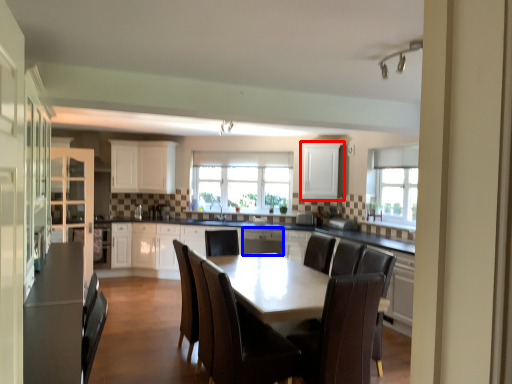
Question: Which point is closer to the camera, cabinetry (highlighted by a red box) or dish washer (highlighted by a blue box)?

Choices:
 (A) cabinetry
 (B) dish washer

Answer: (B)